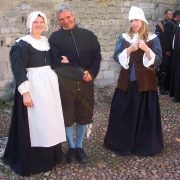
The height and width of the screenshot is (180, 180). I want to click on brick wall, so click(114, 25).